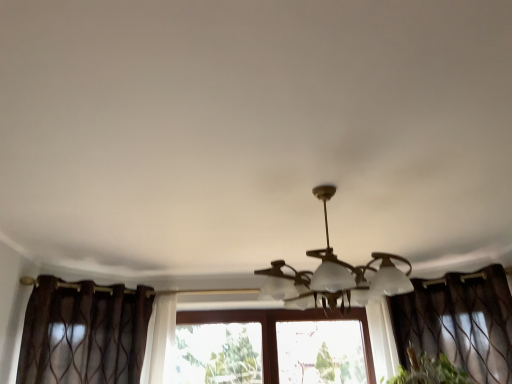
Question: Is brown sheer curtain at right, which ranks as the second curtain in left-to-right order, positioned beyond the bounds of matte white lamp at center?

Choices:
 (A) no
 (B) yes

Answer: (B)

Question: Considering the relative sizes of brown sheer curtain at right, which ranks as the second curtain in left-to-right order, and matte white lamp at center in the image provided, is brown sheer curtain at right, which ranks as the second curtain in left-to-right order, thinner than matte white lamp at center?

Choices:
 (A) no
 (B) yes

Answer: (B)

Question: Can you confirm if brown sheer curtain at right, which is the first curtain from right to left, is shorter than matte white lamp at center?

Choices:
 (A) no
 (B) yes

Answer: (A)

Question: Does brown sheer curtain at right, which ranks as the second curtain in left-to-right order, touch matte white lamp at center?

Choices:
 (A) yes
 (B) no

Answer: (B)

Question: Is brown sheer curtain at right, which is the first curtain from right to left, smaller than matte white lamp at center?

Choices:
 (A) no
 (B) yes

Answer: (B)

Question: Is matte white lamp at center inside brown sheer curtain at right, which ranks as the second curtain in left-to-right order?

Choices:
 (A) no
 (B) yes

Answer: (A)

Question: From a real-world perspective, does brown sheer curtain at right, which ranks as the second curtain in left-to-right order, sit lower than brown sheer curtain at left, arranged as the first curtain when viewed from the left?

Choices:
 (A) yes
 (B) no

Answer: (A)

Question: Does brown sheer curtain at right, which is the first curtain from right to left, turn towards brown sheer curtain at left, arranged as the first curtain when viewed from the left?

Choices:
 (A) no
 (B) yes

Answer: (A)

Question: Is brown sheer curtain at right, which ranks as the second curtain in left-to-right order, positioned behind brown sheer curtain at left, arranged as the first curtain when viewed from the left?

Choices:
 (A) no
 (B) yes

Answer: (B)

Question: Is brown sheer curtain at right, which ranks as the second curtain in left-to-right order, to the left of brown sheer curtain at left, arranged as the first curtain when viewed from the left, from the viewer's perspective?

Choices:
 (A) yes
 (B) no

Answer: (B)

Question: Does brown sheer curtain at right, which is the first curtain from right to left, have a greater width compared to brown sheer curtain at left, positioned as the second curtain in right-to-left order?

Choices:
 (A) no
 (B) yes

Answer: (B)

Question: Is brown sheer curtain at right, which is the first curtain from right to left, not near brown sheer curtain at left, positioned as the second curtain in right-to-left order?

Choices:
 (A) yes
 (B) no

Answer: (A)

Question: Considering the relative positions of matte white lamp at center and brown sheer curtain at left, arranged as the first curtain when viewed from the left, in the image provided, is matte white lamp at center to the right of brown sheer curtain at left, arranged as the first curtain when viewed from the left, from the viewer's perspective?

Choices:
 (A) yes
 (B) no

Answer: (A)